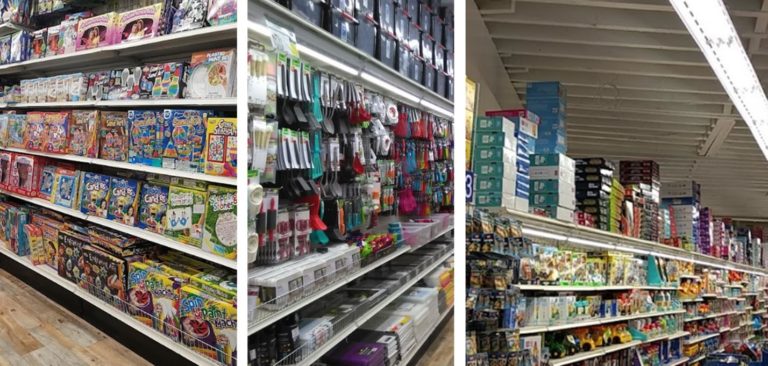
Find the location of a particular element. The width and height of the screenshot is (768, 366). ceiling is located at coordinates (581, 58).